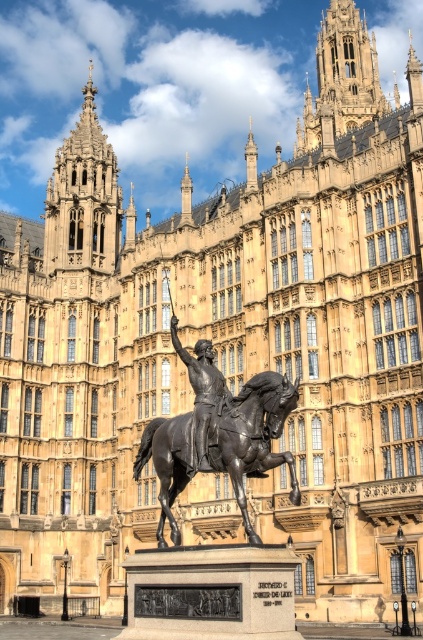
Question: Which object is the farthest from the bronze statue at center?

Choices:
 (A) golden stone tower at upper left
 (B) golden stone tower at upper center

Answer: (B)

Question: Is golden stone tower at upper left bigger than golden stone tower at upper center?

Choices:
 (A) no
 (B) yes

Answer: (B)

Question: Can you confirm if golden stone tower at upper left is bigger than bronze statue at center?

Choices:
 (A) yes
 (B) no

Answer: (A)

Question: Which point is farther to the camera?

Choices:
 (A) (202, 339)
 (B) (360, 58)
 (C) (110, 189)

Answer: (B)

Question: Can you confirm if bronze textured horse at center is positioned below golden stone tower at upper left?

Choices:
 (A) no
 (B) yes

Answer: (B)

Question: Which of the following is the farthest from the observer?

Choices:
 (A) (258, 476)
 (B) (114, 216)
 (C) (340, 20)
 (D) (208, 384)

Answer: (C)